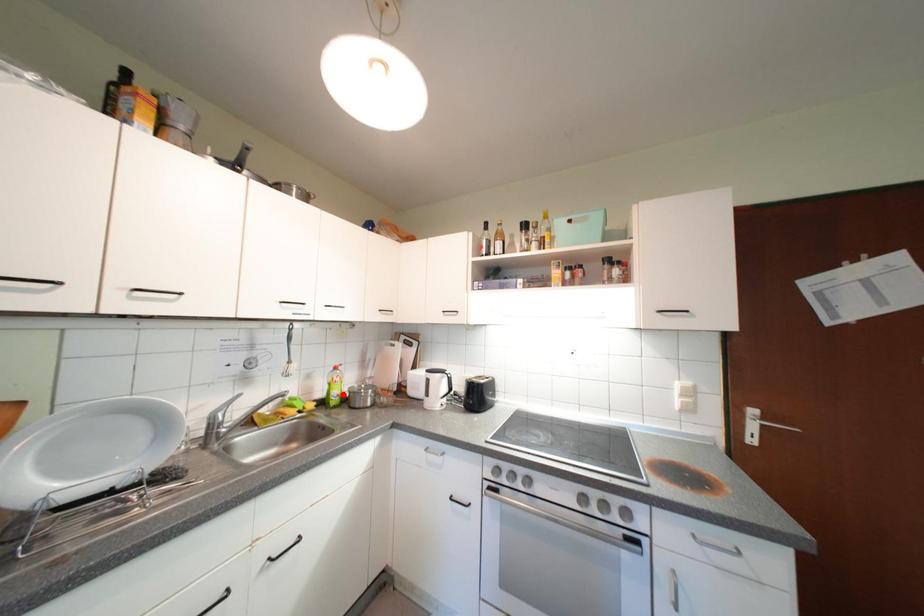
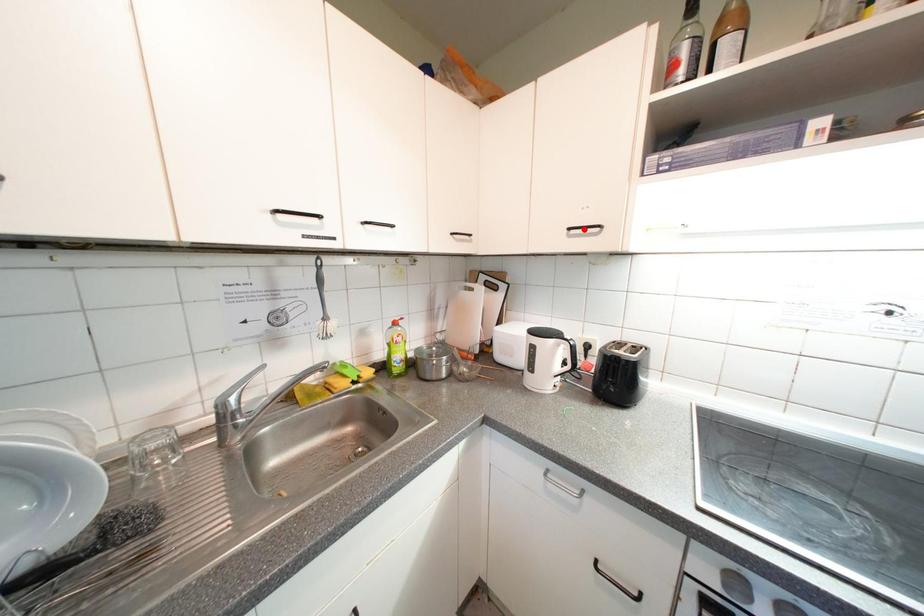
I am providing you with two images of the same scene from different viewpoints. A red point is marked on the first image and another point is marked on the second image. Is the marked point in image1 the same physical position as the marked point in image2?

No